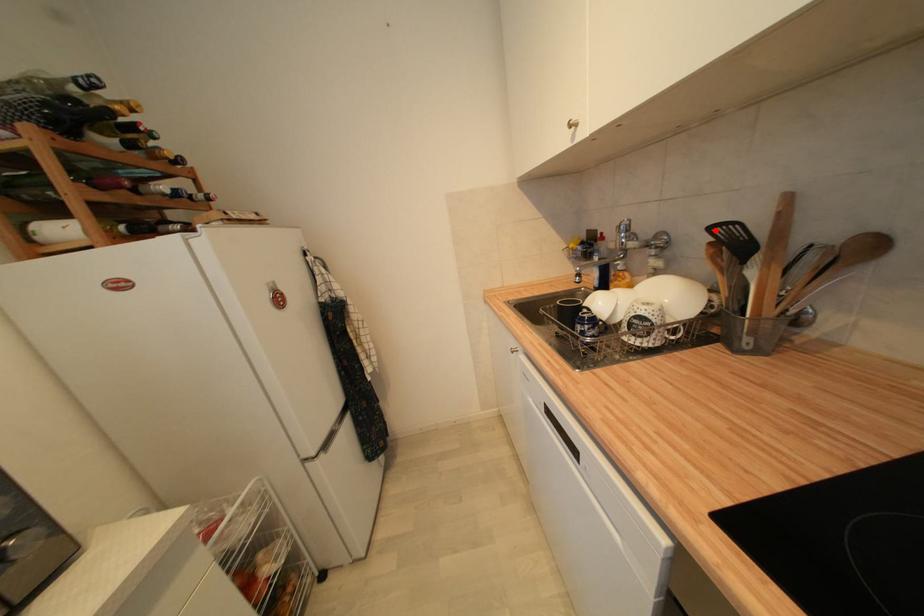
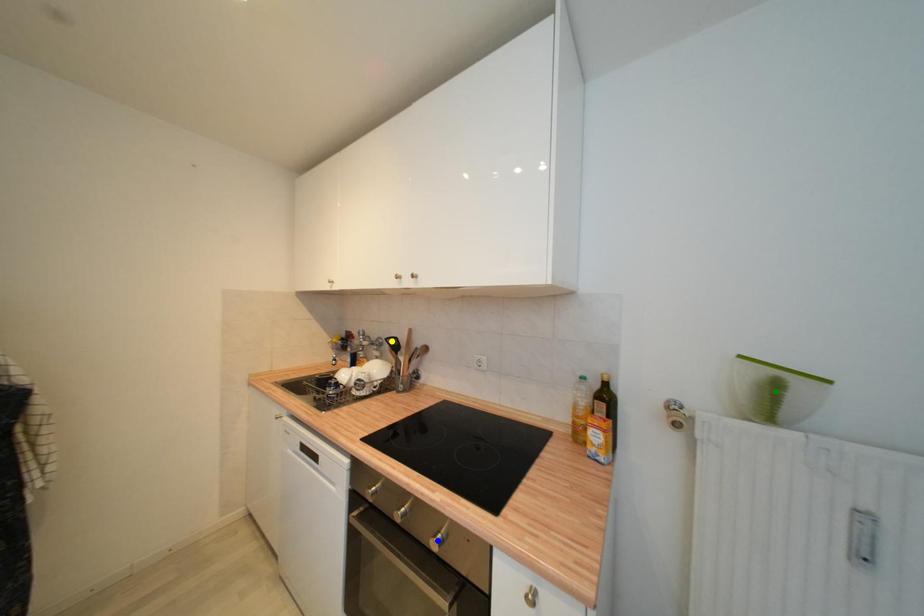
Question: I am providing you with two images of the same scene from different viewpoints. A red point is marked on the first image. You are given multiple points on the second image. Which point in image 2 is actually the same real-world point as the red point in image 1?

Choices:
 (A) blue point
 (B) yellow point
 (C) green point

Answer: (B)